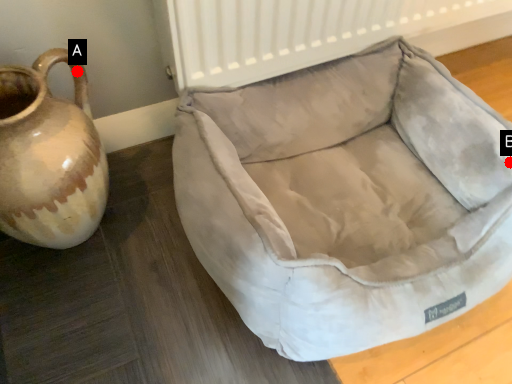
Question: Two points are circled on the image, labeled by A and B beside each circle. Which of the following is the closest to the observer?

Choices:
 (A) A is closer
 (B) B is closer

Answer: (A)